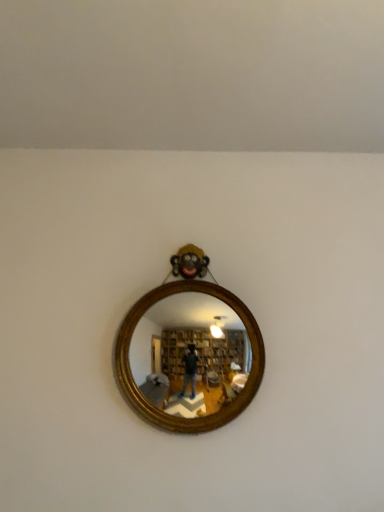
Locate an element on the screen. The image size is (384, 512). gold wooden mirror at center is located at coordinates (186, 347).

What do you see at coordinates (186, 347) in the screenshot? This screenshot has height=512, width=384. I see `gold wooden mirror at center` at bounding box center [186, 347].

The width and height of the screenshot is (384, 512). In order to click on gold wooden mirror at center in this screenshot , I will do `click(186, 347)`.